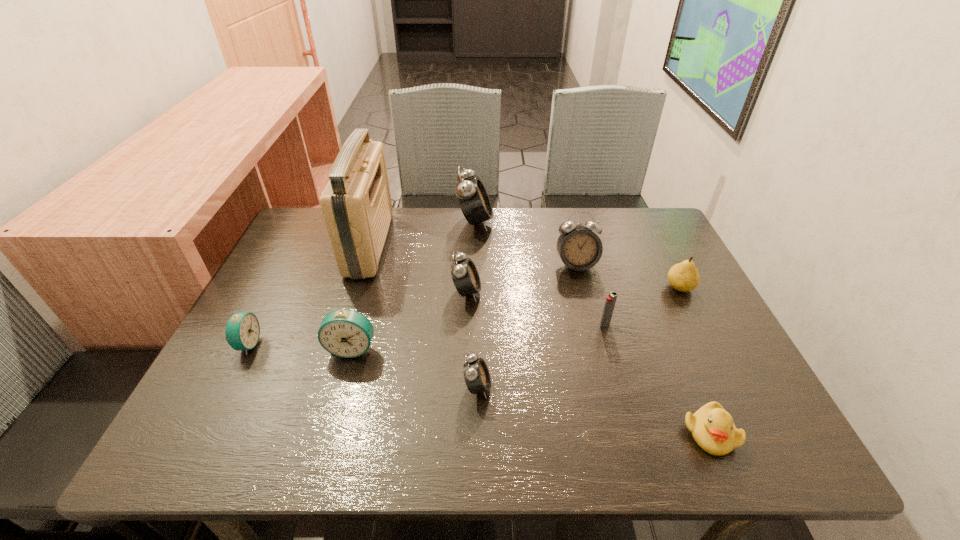
Locate an element on the screen. The image size is (960, 540). object that stands as the ninth closest to the farthest alarm clock is located at coordinates (713, 429).

Identify which alarm clock is located as the third nearest to the shortest object. Please provide its 2D coordinates. Your answer should be formatted as a tuple, i.e. [(x, y)], where the tuple contains the x and y coordinates of a point satisfying the conditions above.

[(465, 276)]

You are a GUI agent. You are given a task and a screenshot of the screen. Output one action in this format:
    pyautogui.click(x=<x>, y=<y>)
    Task: Click on the alarm clock that is the third nearest to the sixth farthest object
    The height and width of the screenshot is (540, 960).
    Given the screenshot: What is the action you would take?
    pyautogui.click(x=476, y=374)

Locate an element on the screen. The image size is (960, 540). white alarm clock that stands as the third closest to the ninth farthest object is located at coordinates (473, 199).

Locate an element on the screen. This screenshot has height=540, width=960. white alarm clock that is the closest one to the third tallest object is located at coordinates 473,199.

Locate an element on the screen. The width and height of the screenshot is (960, 540). vacant position in the image that satisfies the following two spatial constraints: 1. on the face of the second biggest white alarm clock; 2. on the right side of the fifth nearest object is located at coordinates (591, 324).

Find the location of a particular element. free space in the image that satisfies the following two spatial constraints: 1. on the face of the eighth shortest object; 2. on the face of the third farthest white alarm clock is located at coordinates (583, 292).